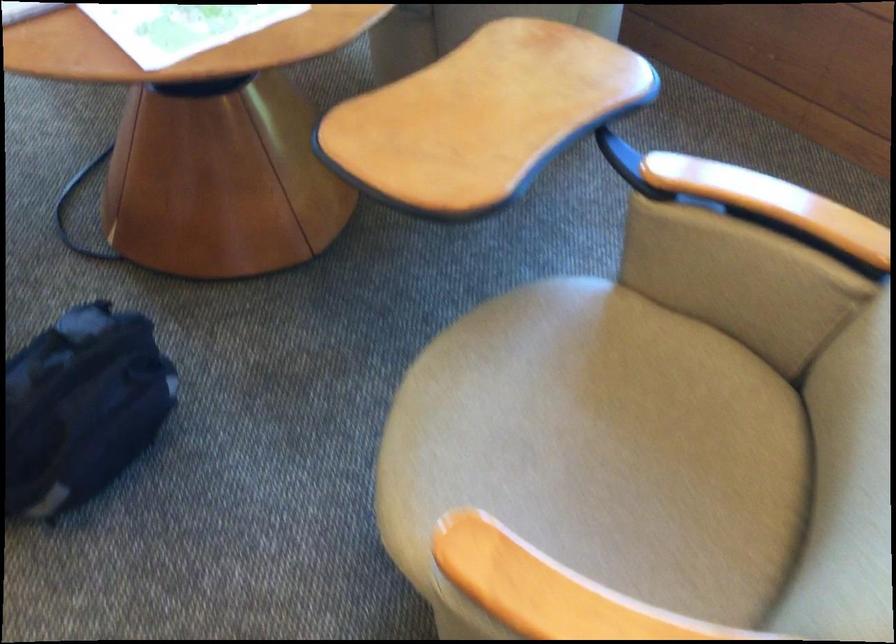
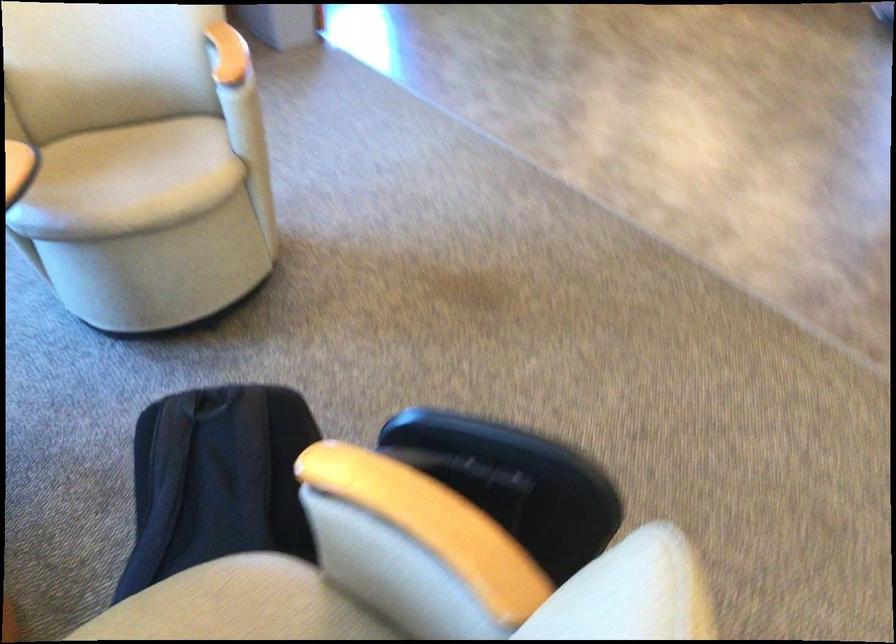
In the second image, find the point that corresponds to the point at 402,503 in the first image.

(127, 180)